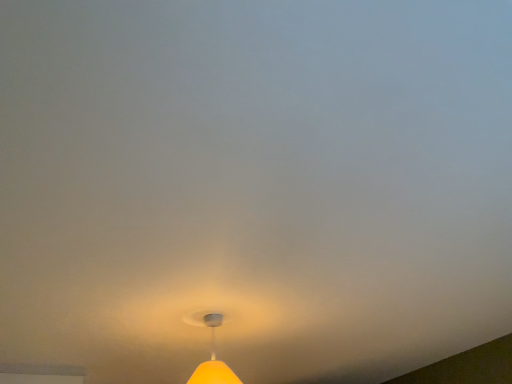
Identify the location of matte yellow lampshade at center. Image resolution: width=512 pixels, height=384 pixels. (213, 360).

What do you see at coordinates (213, 360) in the screenshot?
I see `matte yellow lampshade at center` at bounding box center [213, 360].

Locate an element on the screen. The width and height of the screenshot is (512, 384). matte yellow lampshade at center is located at coordinates (213, 360).